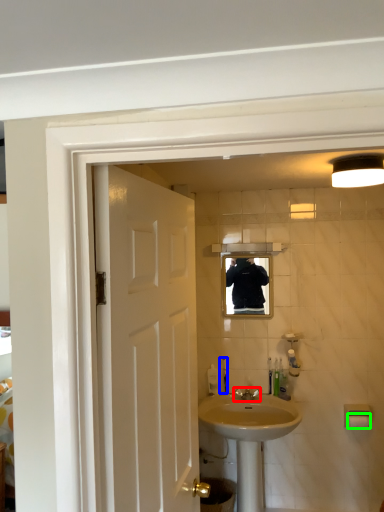
Question: Which is nearer to the tap (highlighted by a red box)? toiletry (highlighted by a blue box) or towel bar (highlighted by a green box).

Choices:
 (A) toiletry
 (B) towel bar

Answer: (A)